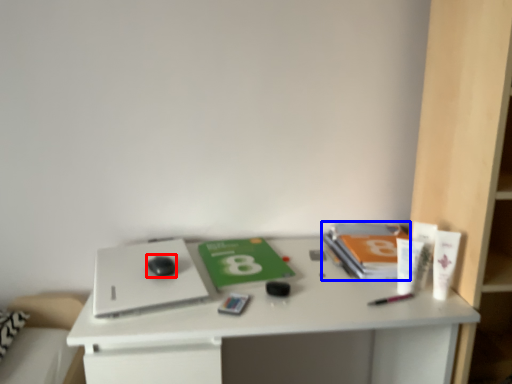
Question: Which of the following is the closest to the observer, mouse (highlighted by a red box) or paperback book (highlighted by a blue box)?

Choices:
 (A) mouse
 (B) paperback book

Answer: (A)